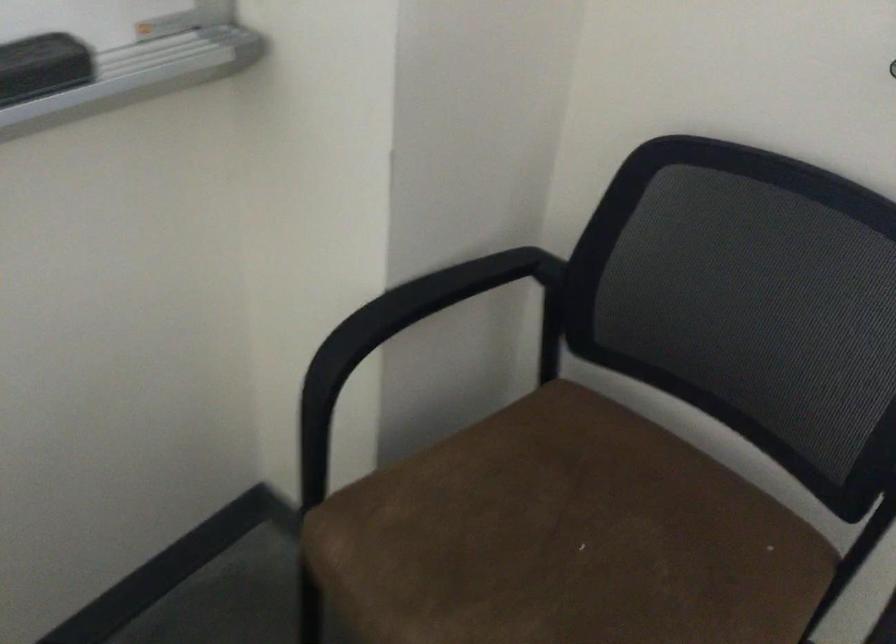
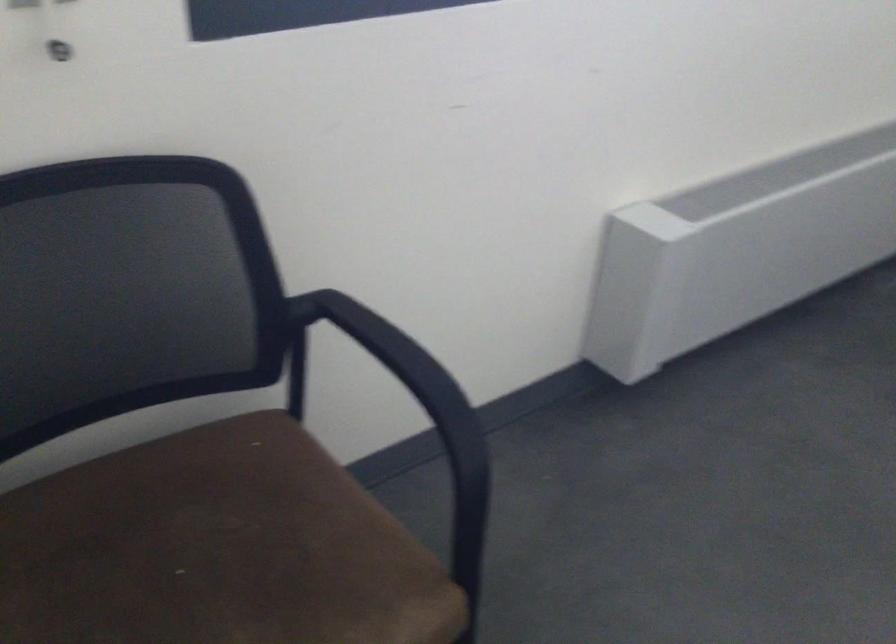
The point at (622, 570) is marked in the first image. Where is the corresponding point in the second image?

(216, 549)